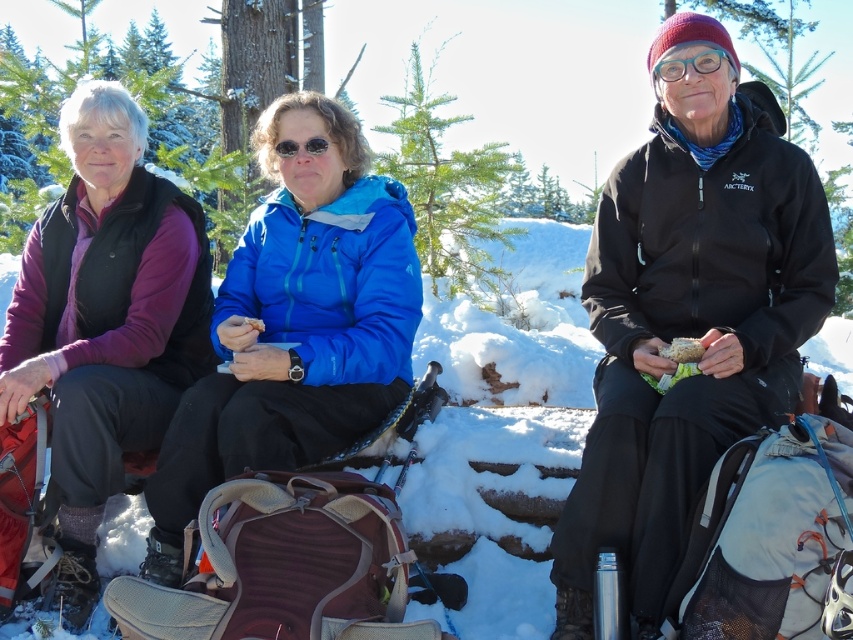
Who is positioned more to the right, black softshell jacket at center or matte plastic sandwich at center?

black softshell jacket at center

Which is behind, point (622, 352) or point (666, 346)?

The point (622, 352) is behind.

Image resolution: width=853 pixels, height=640 pixels. Describe the element at coordinates (688, 317) in the screenshot. I see `black softshell jacket at center` at that location.

Where is `black softshell jacket at center`? black softshell jacket at center is located at coordinates (688, 317).

Who is positioned more to the left, matte black jacket at center or white paper sandwich at center?

From the viewer's perspective, white paper sandwich at center appears more on the left side.

Between matte black jacket at center and white paper sandwich at center, which one is positioned lower?

matte black jacket at center is below.

Is point (345, 243) positioned in front of point (260, 321)?

No.

Identify the location of matte black jacket at center. (296, 323).

Can you confirm if matte black jacket at center is positioned above transparent blue goggles at center?

Incorrect, matte black jacket at center is not positioned above transparent blue goggles at center.

Between point (170, 420) and point (709, 45), which one is positioned behind?

The point (170, 420) is behind.

I want to click on matte black jacket at center, so click(296, 323).